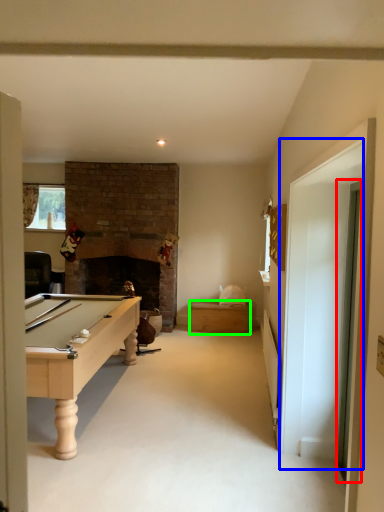
Question: Which is farther away from glass door (highlighted by a red box)? glass door (highlighted by a blue box) or drawer (highlighted by a green box)?

Choices:
 (A) glass door
 (B) drawer

Answer: (B)